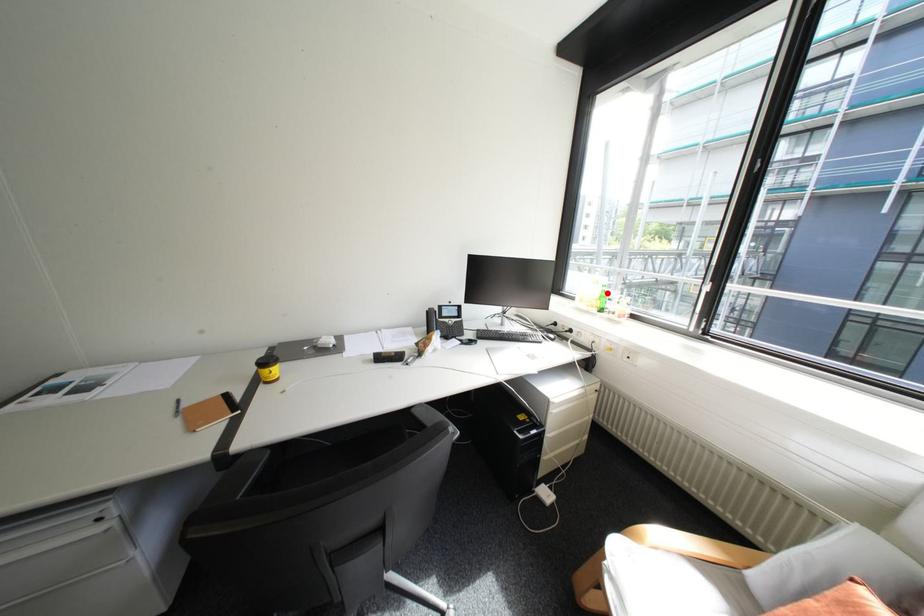
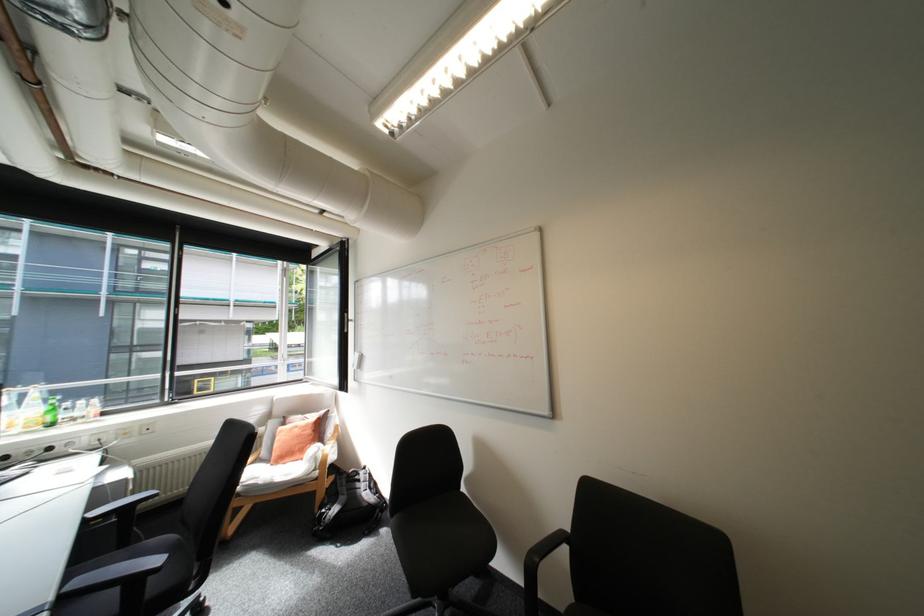
The point at the highlighted location is marked in the first image. Where is the corresponding point in the second image?

(55, 408)